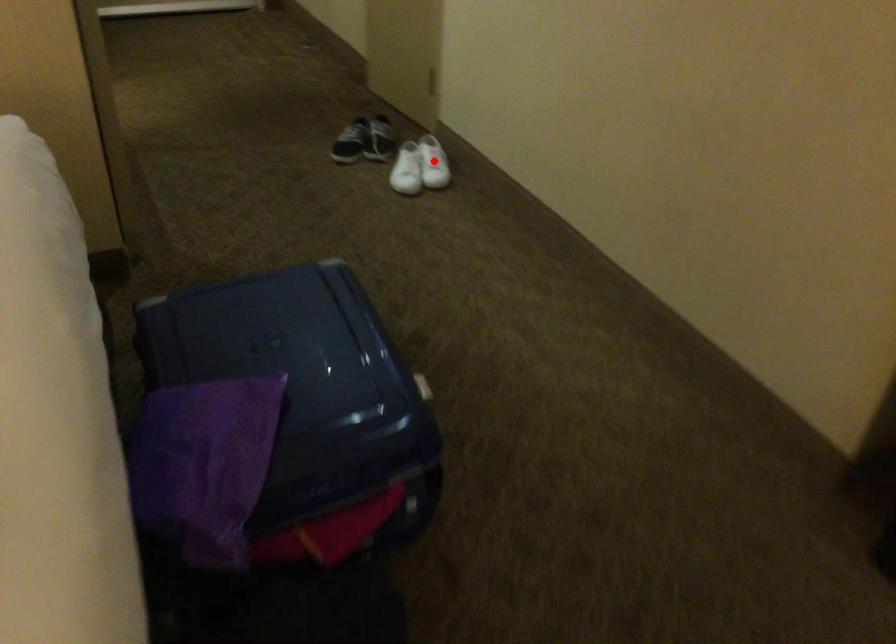
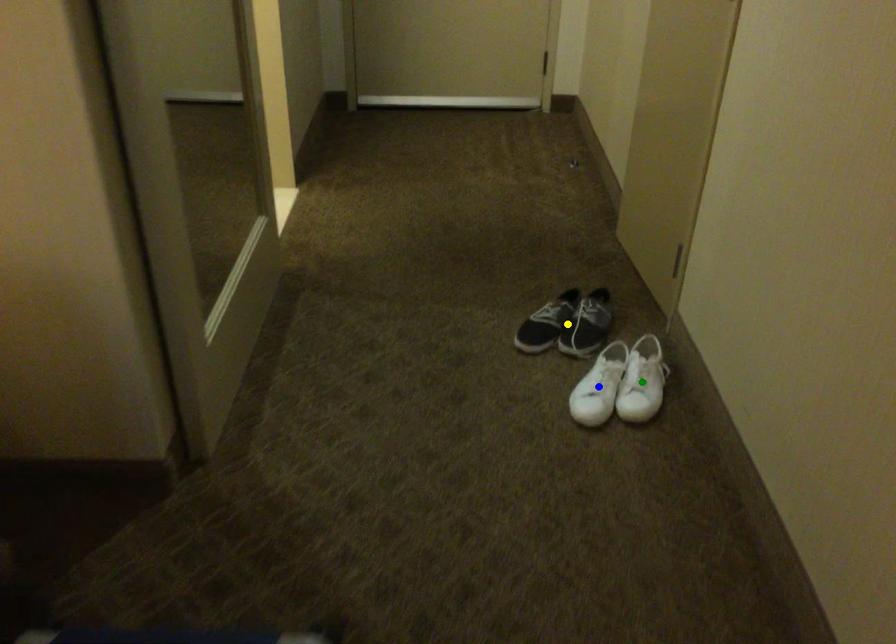
Question: I am providing you with two images of the same scene from different viewpoints. A red point is marked on the first image. You are given multiple points on the second image. In image 2, which mark is for the same physical point as the one in image 1?

Choices:
 (A) green point
 (B) yellow point
 (C) blue point

Answer: (A)